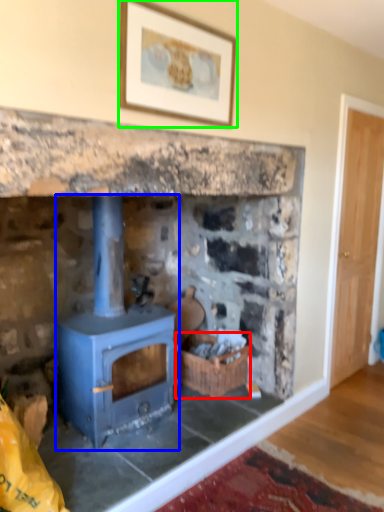
Question: Based on their relative distances, which object is farther from basket (highlighted by a red box)? Choose from wood burning stove (highlighted by a blue box) and picture frame (highlighted by a green box).

Choices:
 (A) wood burning stove
 (B) picture frame

Answer: (B)